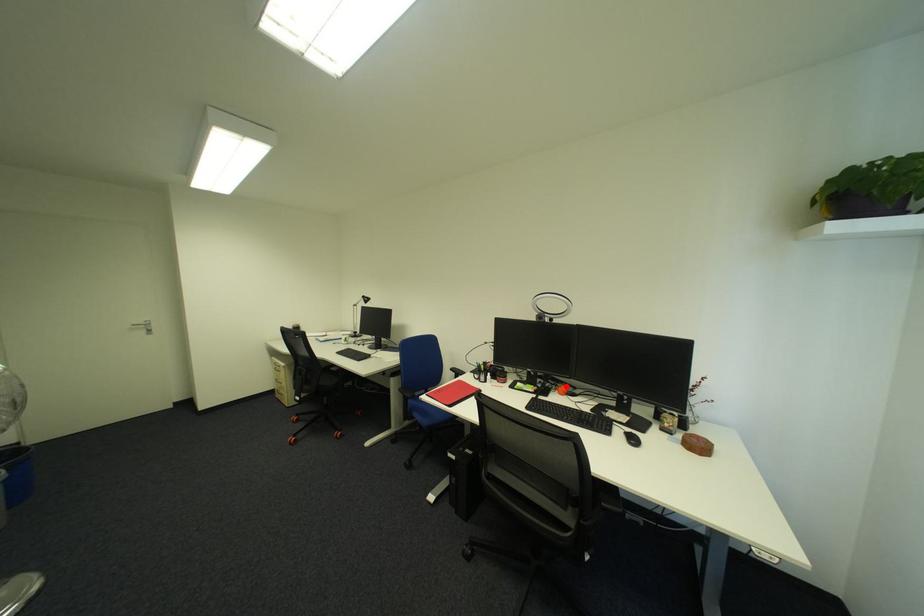
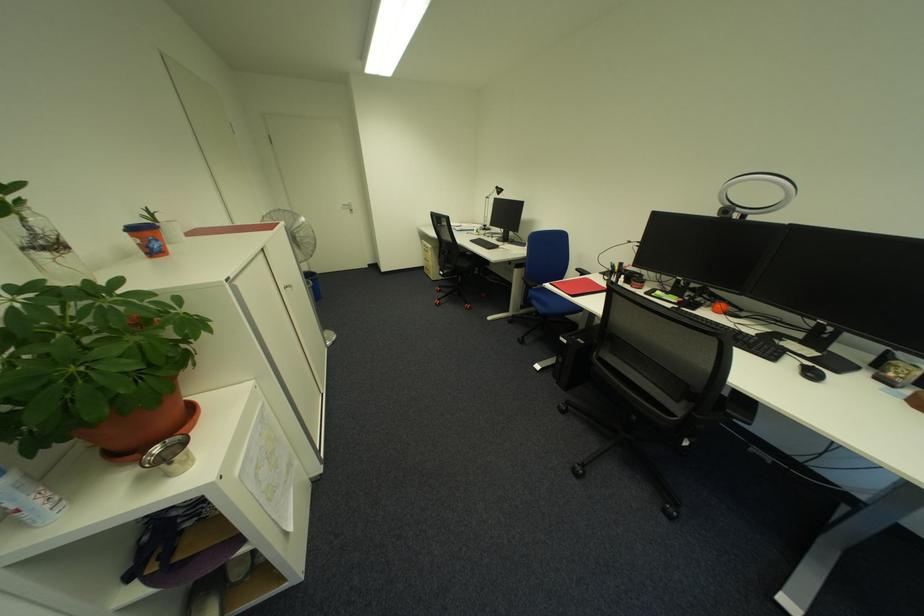
Where in the second image is the point corresponding to the highlighted location from the first image?

(723, 302)